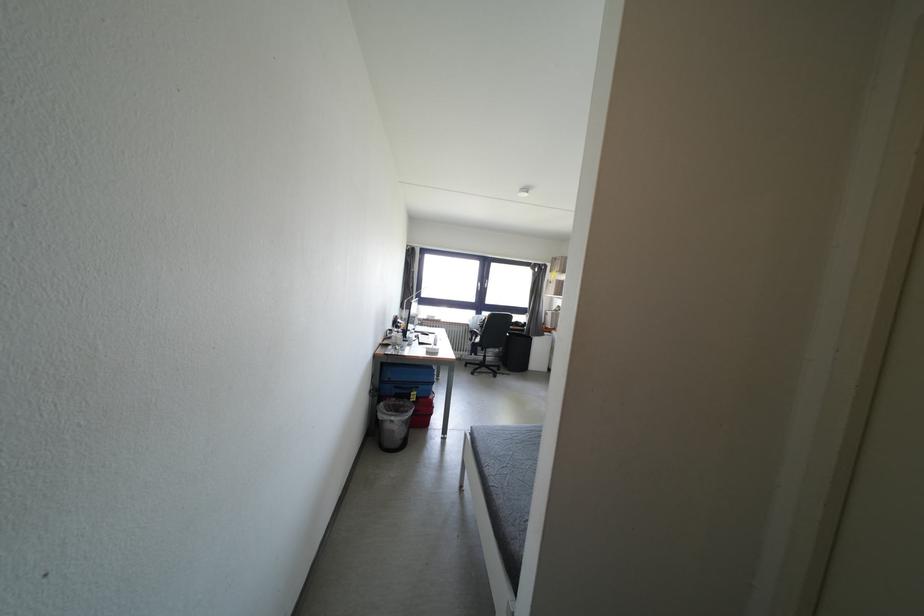
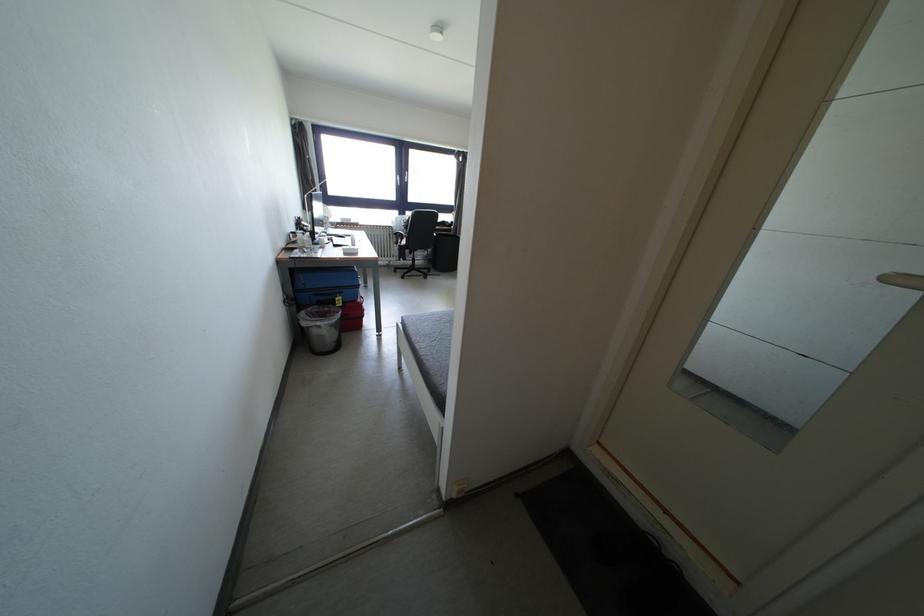
The point at (477,331) is marked in the first image. Where is the corresponding point in the second image?

(400, 233)